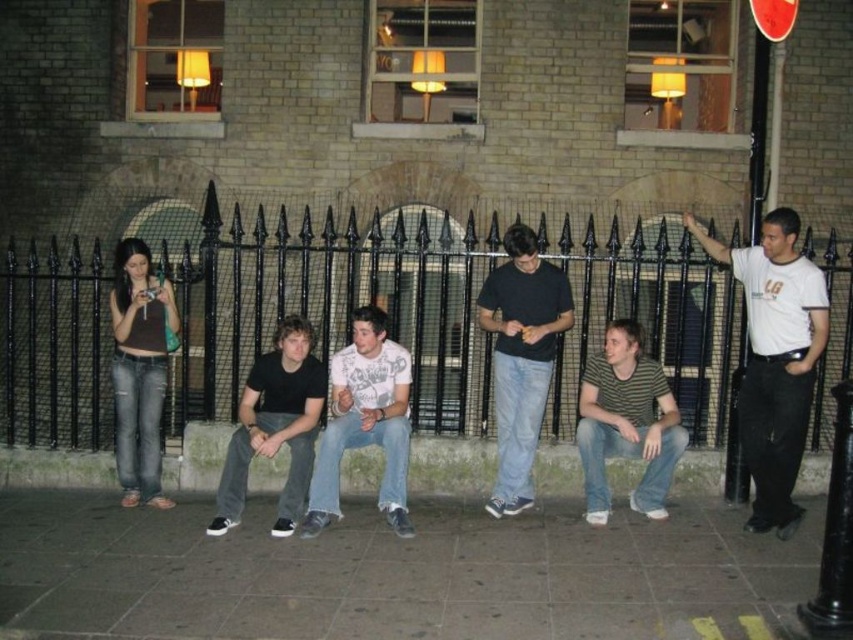
Who is lower down, black metal fence at center or gray concrete pavement at lower center?

Positioned lower is gray concrete pavement at lower center.

Between black metal fence at center and gray concrete pavement at lower center, which one appears on the left side from the viewer's perspective?

From the viewer's perspective, gray concrete pavement at lower center appears more on the left side.

Does point (665, 310) lie behind point (390, 532)?

That is True.

Where is `black metal fence at center`? The image size is (853, 640). black metal fence at center is located at coordinates (332, 300).

Is black metal fence at center to the left of striped cotton shirt at center from the viewer's perspective?

Incorrect, black metal fence at center is not on the left side of striped cotton shirt at center.

Is black metal fence at center further to the viewer compared to striped cotton shirt at center?

That is True.

Image resolution: width=853 pixels, height=640 pixels. Describe the element at coordinates (332, 300) in the screenshot. I see `black metal fence at center` at that location.

At what (x,y) coordinates should I click in order to perform the action: click on black metal fence at center. Please return your answer as a coordinate pair (x, y). This screenshot has width=853, height=640. Looking at the image, I should click on (332, 300).

Is black metal fence at center closer to camera compared to black matte shirt at center?

No, black metal fence at center is further to the viewer.

Can you confirm if black metal fence at center is positioned above black matte shirt at center?

Correct, black metal fence at center is located above black matte shirt at center.

What are the coordinates of `black metal fence at center` in the screenshot? It's located at coord(332,300).